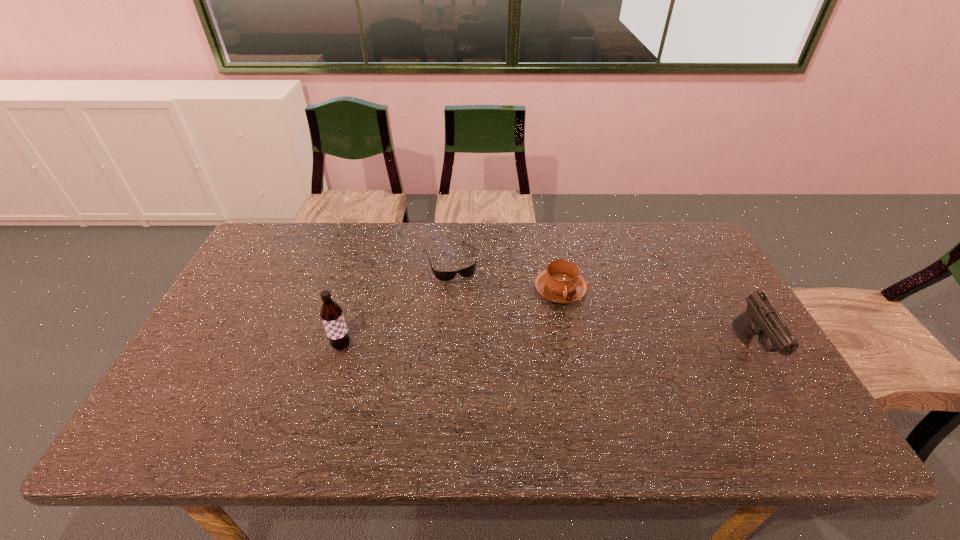
Locate an element on the screen. This screenshot has height=540, width=960. the tallest object is located at coordinates (331, 313).

You are a GUI agent. You are given a task and a screenshot of the screen. Output one action in this format:
    pyautogui.click(x=<x>, y=<y>)
    Task: Click on the leftmost object
    
    Given the screenshot: What is the action you would take?
    pyautogui.click(x=331, y=313)

Where is `the third shortest object`? Image resolution: width=960 pixels, height=540 pixels. the third shortest object is located at coordinates (760, 318).

Identify the location of the rightmost object. This screenshot has width=960, height=540. (760, 318).

I want to click on the third tallest object, so click(x=561, y=282).

Locate an element on the screen. Image resolution: width=960 pixels, height=540 pixels. cappuccino is located at coordinates (561, 282).

Where is `sunglasses`? sunglasses is located at coordinates (440, 275).

Locate an element on the screen. the second object from left to right is located at coordinates (440, 275).

Locate an element on the screen. The width and height of the screenshot is (960, 540). vacant space positioned 0.220m on the right of the leftmost object is located at coordinates (436, 346).

Where is `free spot located at the barrel of the pistol`? This screenshot has width=960, height=540. free spot located at the barrel of the pistol is located at coordinates tap(782, 403).